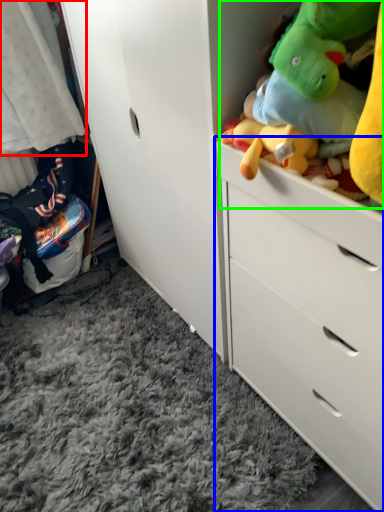
Question: Considering the real-world distances, which object is farthest from baby clothe (highlighted by a red box)? chest of drawers (highlighted by a blue box) or stuff (highlighted by a green box)?

Choices:
 (A) chest of drawers
 (B) stuff

Answer: (B)